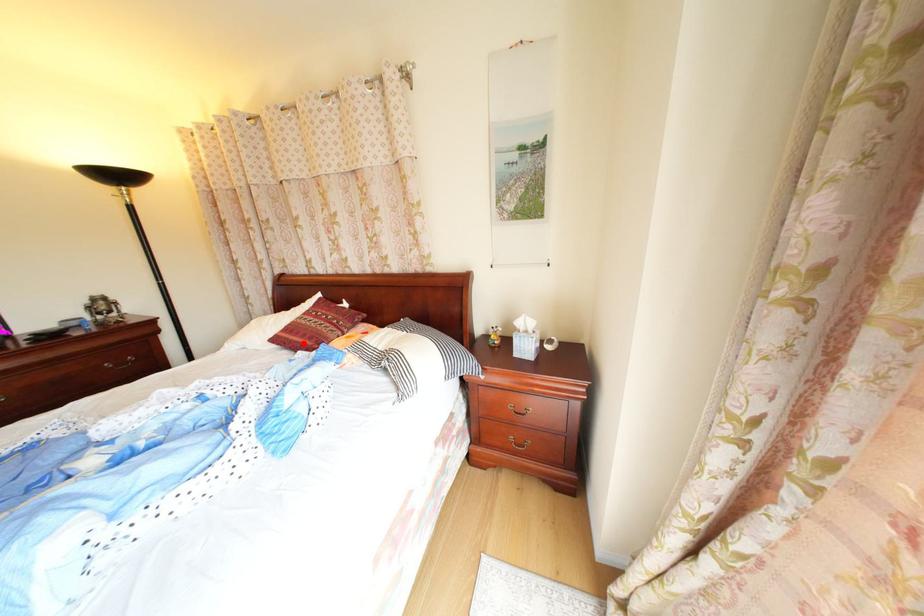
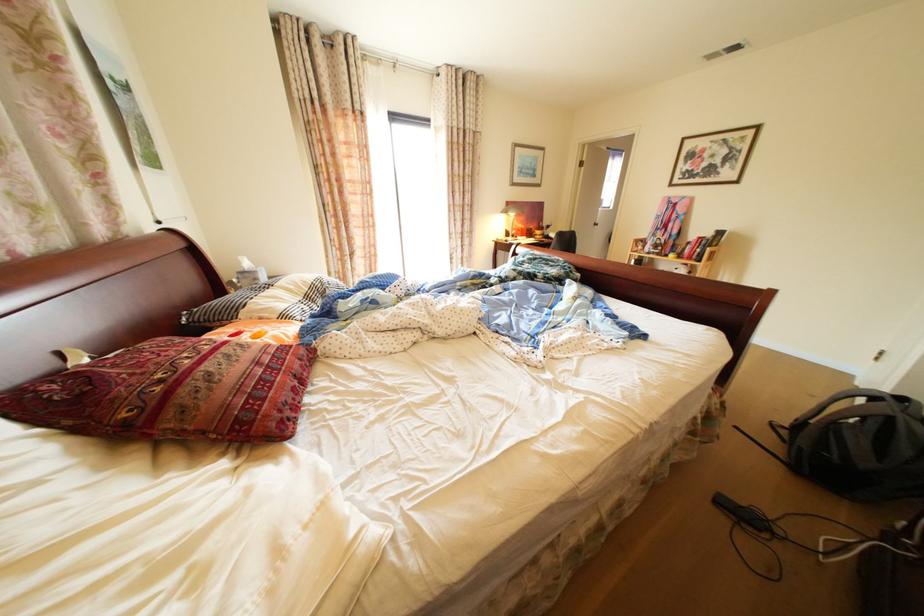
Where in the second image is the point corresponding to the highlighted location from the first image?

(309, 378)